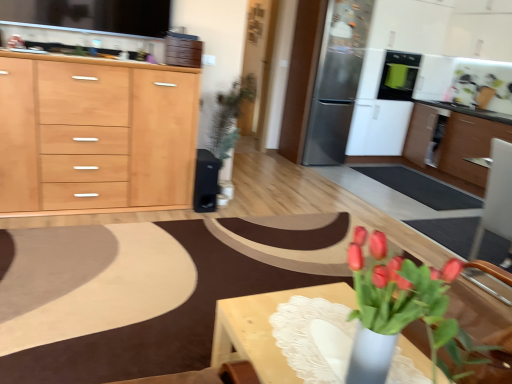
Where is `free space in front of stainless steel refrigerator at upper right`? This screenshot has width=512, height=384. free space in front of stainless steel refrigerator at upper right is located at coordinates (369, 179).